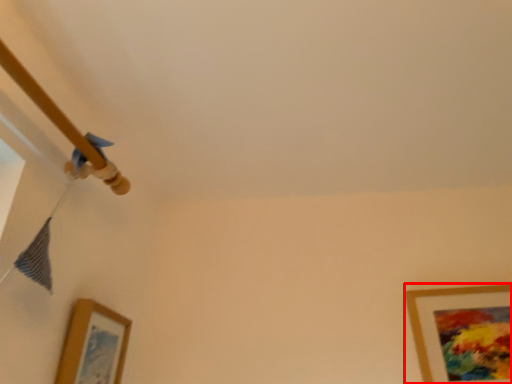
Question: From the image's perspective, considering the relative positions of picture frame (annotated by the red box) and picture frame in the image provided, where is picture frame (annotated by the red box) located with respect to the staircase?

Choices:
 (A) above
 (B) below

Answer: (B)